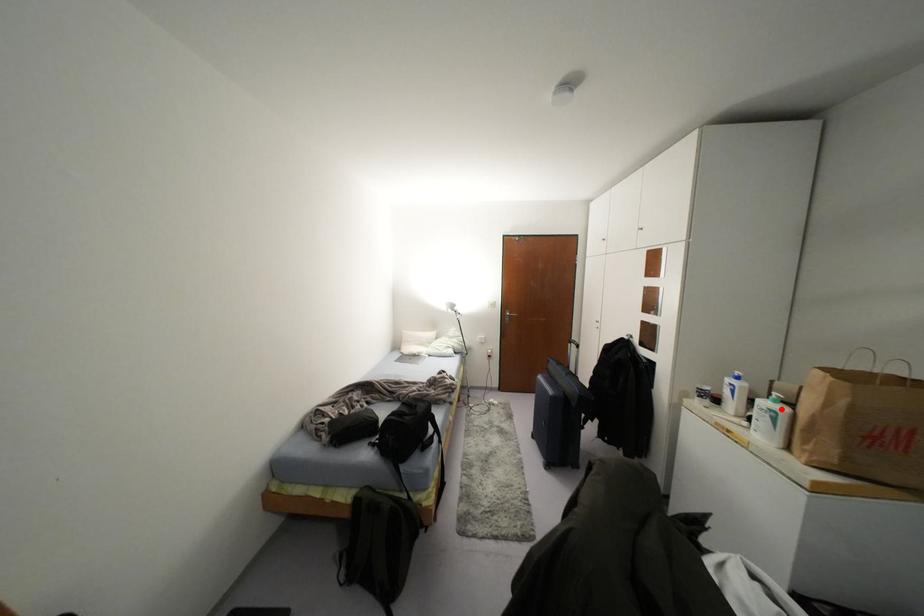
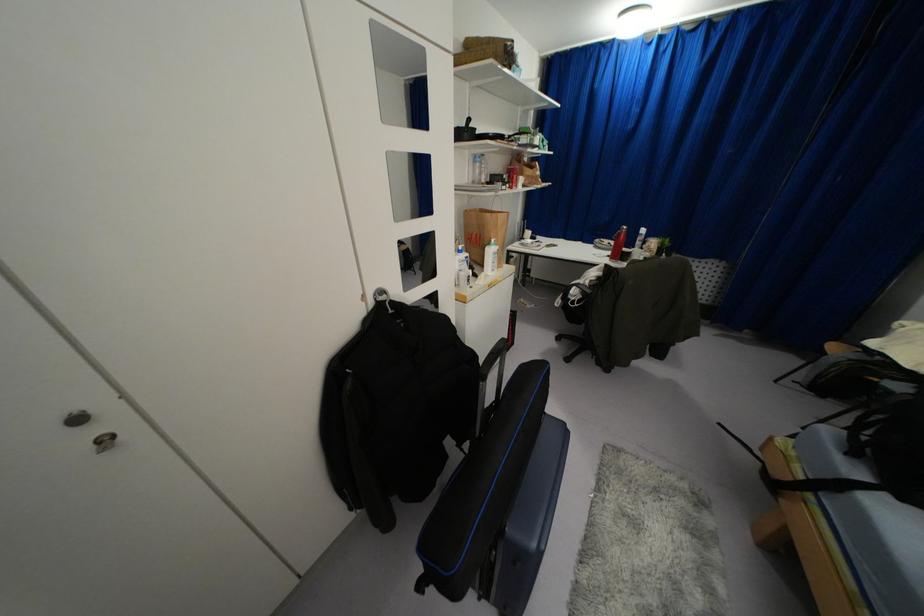
Question: I am providing you with two images of the same scene from different viewpoints. A red point is marked on the first image. At the location where the point appears in image 1, is it still visible in image 2?

Choices:
 (A) Yes
 (B) No

Answer: (A)